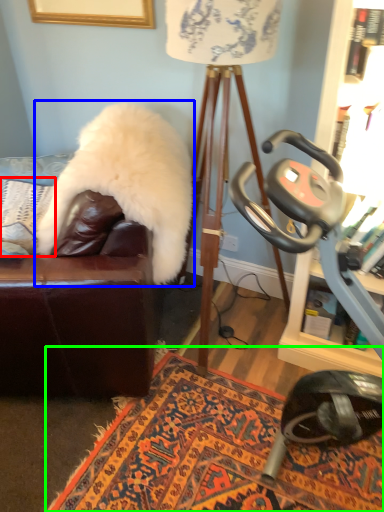
Question: Considering the real-world distances, which object is farthest from pillow (highlighted by a red box)? fur coat (highlighted by a blue box) or mat (highlighted by a green box)?

Choices:
 (A) fur coat
 (B) mat

Answer: (B)